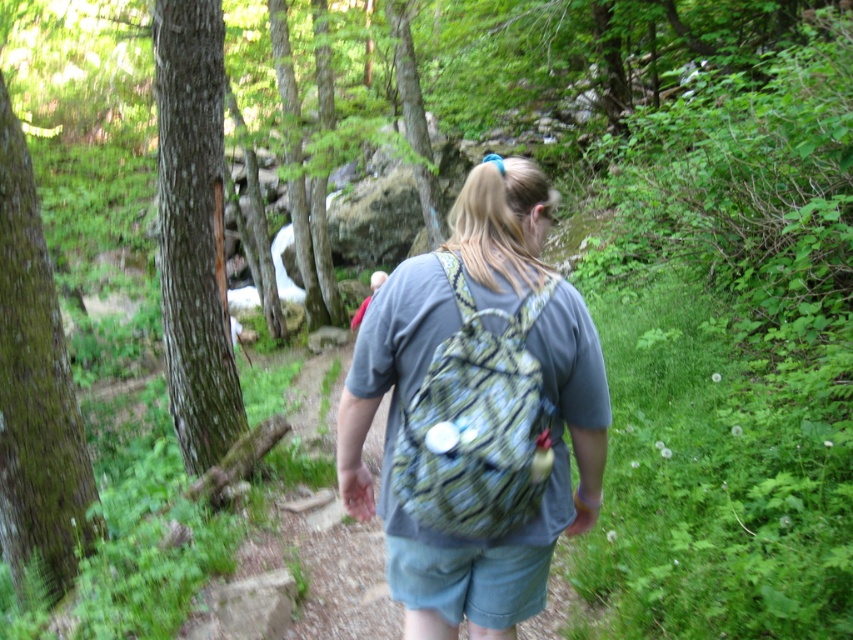
Question: Does printed fabric backpack at center appear on the left side of camouflage fabric backpack at center?

Choices:
 (A) no
 (B) yes

Answer: (B)

Question: Which of the following is the farthest from the observer?

Choices:
 (A) printed fabric backpack at center
 (B) camouflage fabric backpack at center

Answer: (A)

Question: Does printed fabric backpack at center have a greater width compared to camouflage fabric backpack at center?

Choices:
 (A) no
 (B) yes

Answer: (B)

Question: Which of the following is the closest to the observer?

Choices:
 (A) printed fabric backpack at center
 (B) camouflage fabric backpack at center

Answer: (B)

Question: Among these objects, which one is nearest to the camera?

Choices:
 (A) printed fabric backpack at center
 (B) camouflage fabric backpack at center

Answer: (B)

Question: Is the position of printed fabric backpack at center more distant than that of camouflage fabric backpack at center?

Choices:
 (A) no
 (B) yes

Answer: (B)